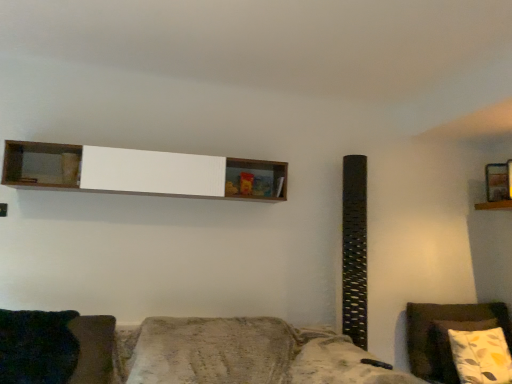
Question: In terms of width, does textured brown fabric couch at lower center look wider or thinner when compared to dark green fabric pillow at lower left?

Choices:
 (A) thin
 (B) wide

Answer: (B)

Question: Is point (310, 360) positioned closer to the camera than point (24, 324)?

Choices:
 (A) closer
 (B) farther

Answer: (B)

Question: Considering the real-world distances, which object is farthest from the floral pillow at right?

Choices:
 (A) textured brown fabric couch at lower center
 (B) wooden shelf at upper right, acting as the 1th shelf starting from the right
 (C) white wood shelf at upper center, which appears as the second shelf when viewed from the right
 (D) dark green fabric pillow at lower left

Answer: (D)

Question: Estimate the real-world distances between objects in this image. Which object is closer to the wooden shelf at upper right, acting as the 1th shelf starting from the right?

Choices:
 (A) floral pillow at right
 (B) dark green fabric pillow at lower left
 (C) textured brown fabric couch at lower center
 (D) white wood shelf at upper center, the 2th shelf in the back-to-front sequence

Answer: (A)